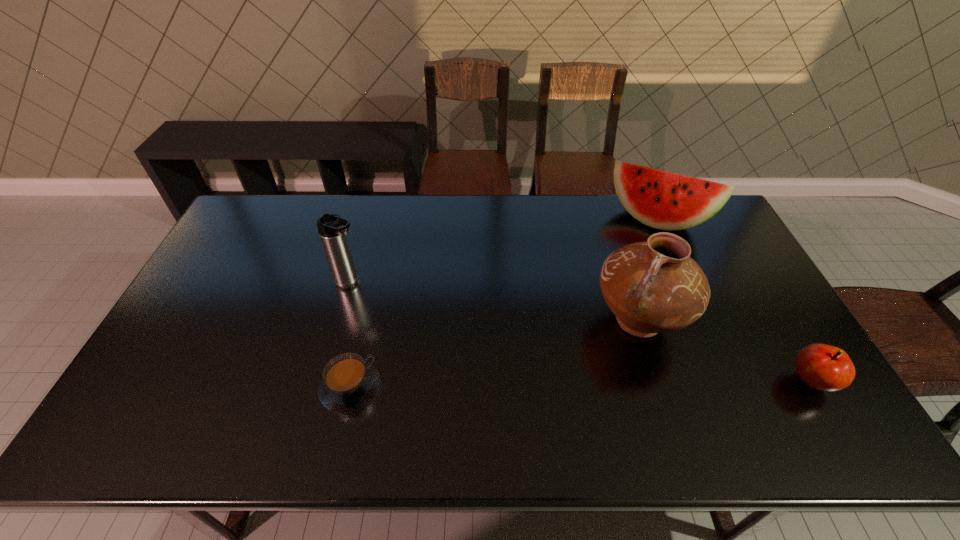
The image size is (960, 540). I want to click on unoccupied position between the thermos bottle and the cappuccino, so click(x=350, y=335).

The image size is (960, 540). In order to click on vacant area between the apple and the pottery in this screenshot , I will do `click(725, 351)`.

Locate an element on the screen. Image resolution: width=960 pixels, height=540 pixels. free spot between the shortest object and the thermos bottle is located at coordinates (350, 335).

Where is `free spot between the thermos bottle and the shortest object`? free spot between the thermos bottle and the shortest object is located at coordinates (350, 335).

Locate an element on the screen. The width and height of the screenshot is (960, 540). empty space that is in between the cappuccino and the pottery is located at coordinates (494, 354).

This screenshot has width=960, height=540. Find the location of `vacant space that is in between the shortest object and the pottery`. vacant space that is in between the shortest object and the pottery is located at coordinates (494, 354).

Find the location of a particular element. Image resolution: width=960 pixels, height=540 pixels. vacant point located between the pottery and the thermos bottle is located at coordinates (494, 302).

At what (x,y) coordinates should I click in order to perform the action: click on vacant region between the shortest object and the fourth tallest object. Please return your answer as a coordinate pair (x, y). Looking at the image, I should click on (581, 384).

Where is `the fourth closest object relative to the second shortest object`? This screenshot has height=540, width=960. the fourth closest object relative to the second shortest object is located at coordinates (332, 229).

Where is `object that is the closest one to the thermos bottle`? object that is the closest one to the thermos bottle is located at coordinates (349, 382).